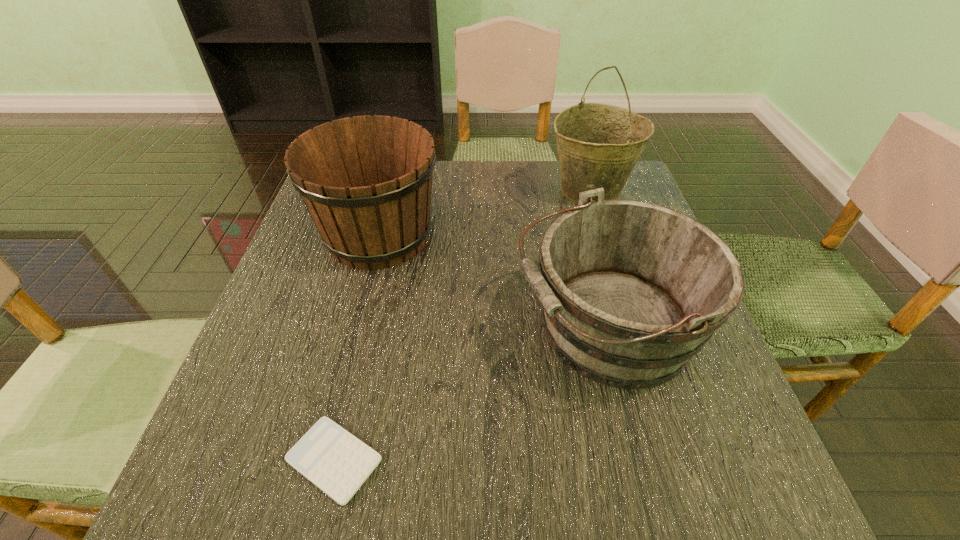
Locate an element on the screen. The image size is (960, 540). the tallest wine bucket is located at coordinates (598, 144).

This screenshot has width=960, height=540. In order to click on the leftmost wine bucket in this screenshot , I will do `click(366, 181)`.

You are a GUI agent. You are given a task and a screenshot of the screen. Output one action in this format:
    pyautogui.click(x=<x>, y=<y>)
    Task: Click on the shortest object
    The image size is (960, 540).
    Given the screenshot: What is the action you would take?
    pyautogui.click(x=337, y=462)

Image resolution: width=960 pixels, height=540 pixels. I want to click on calculator, so click(337, 462).

The image size is (960, 540). I want to click on vacant space situated 0.260m on the left of the tallest object, so coord(445,191).

This screenshot has height=540, width=960. Find the location of `free location located on the right of the leftmost wine bucket`. free location located on the right of the leftmost wine bucket is located at coordinates (607, 235).

You are a GUI agent. You are given a task and a screenshot of the screen. Output one action in this format:
    pyautogui.click(x=<x>, y=<y>)
    Task: Click on the vacant space located 0.100m on the back of the nearest object
    This screenshot has width=960, height=540.
    Given the screenshot: What is the action you would take?
    (356, 365)

Find the location of `object situated at the near edge`. object situated at the near edge is located at coordinates (337, 462).

At what (x,y) coordinates should I click in order to perform the action: click on wine bucket that is at the left edge. Please return your answer as a coordinate pair (x, y). The width and height of the screenshot is (960, 540). Looking at the image, I should click on (366, 181).

Identify the location of calculator located in the left edge section of the desktop. (337, 462).